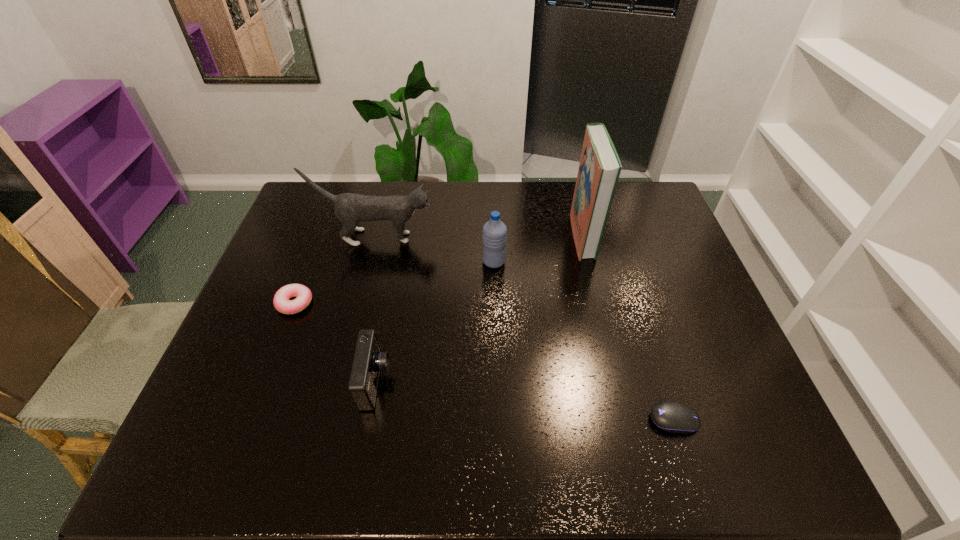
Find the location of a particular element. vacant space that is in between the fourth farthest object and the fourth tallest object is located at coordinates (335, 342).

Where is `empty space that is in between the camera and the computer mouse`? The image size is (960, 540). empty space that is in between the camera and the computer mouse is located at coordinates (525, 401).

This screenshot has height=540, width=960. I want to click on free point between the doughnut and the camera, so click(x=335, y=342).

The height and width of the screenshot is (540, 960). In order to click on free space between the rightmost object and the doughnut in this screenshot , I will do `click(484, 361)`.

Where is `free space between the computer mouse and the third nearest object`? free space between the computer mouse and the third nearest object is located at coordinates (484, 361).

Where is `free area in between the third object from right to left and the cat`? The image size is (960, 540). free area in between the third object from right to left and the cat is located at coordinates (435, 250).

At what (x,y) coordinates should I click in order to perform the action: click on unoccupied area between the cat and the fifth object from left to right. Please return your answer as a coordinate pair (x, y). This screenshot has width=960, height=540. Looking at the image, I should click on (479, 237).

In order to click on free space between the computer mouse and the doughnut in this screenshot , I will do `click(484, 361)`.

Locate which object is the closest to the doughnut. Please provide its 2D coordinates. Your answer should be formatted as a tuple, i.e. [(x, y)], where the tuple contains the x and y coordinates of a point satisfying the conditions above.

[(350, 208)]

Where is `object that can be found as the fourth closest to the cat`? The height and width of the screenshot is (540, 960). object that can be found as the fourth closest to the cat is located at coordinates (600, 167).